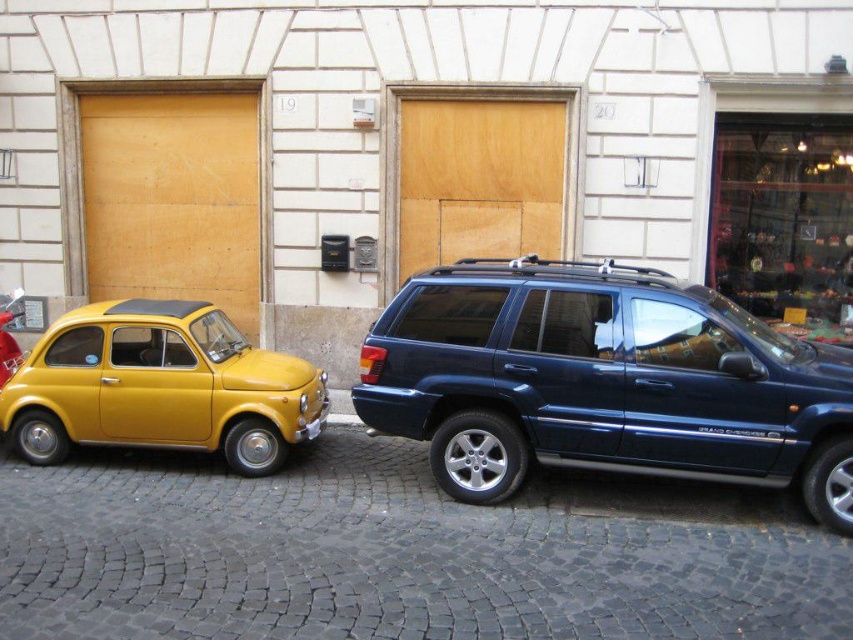
Can you confirm if yellow matte car at left is wider than wooden at center?

Yes.

Is yellow matte car at left behind wooden at center?

No, yellow matte car at left is closer to the viewer.

Who is more forward, (144, 401) or (511, 189)?

Point (144, 401) is more forward.

I want to click on yellow matte car at left, so 160,387.

Does point (390, 304) come closer to viewer compared to point (520, 234)?

That is False.

Is metallic blue minivan at center smaller than wooden at center?

Actually, metallic blue minivan at center might be larger than wooden at center.

Which is behind, point (807, 476) or point (471, 124)?

The point (471, 124) is more distant.

The width and height of the screenshot is (853, 640). I want to click on metallic blue minivan at center, so click(602, 381).

Can you confirm if yellow matte car at left is wider than yellow matte garage door at left?

Indeed, yellow matte car at left has a greater width compared to yellow matte garage door at left.

Does yellow matte car at left have a greater height compared to yellow matte garage door at left?

In fact, yellow matte car at left may be shorter than yellow matte garage door at left.

This screenshot has height=640, width=853. Find the location of `yellow matte car at left`. yellow matte car at left is located at coordinates (160, 387).